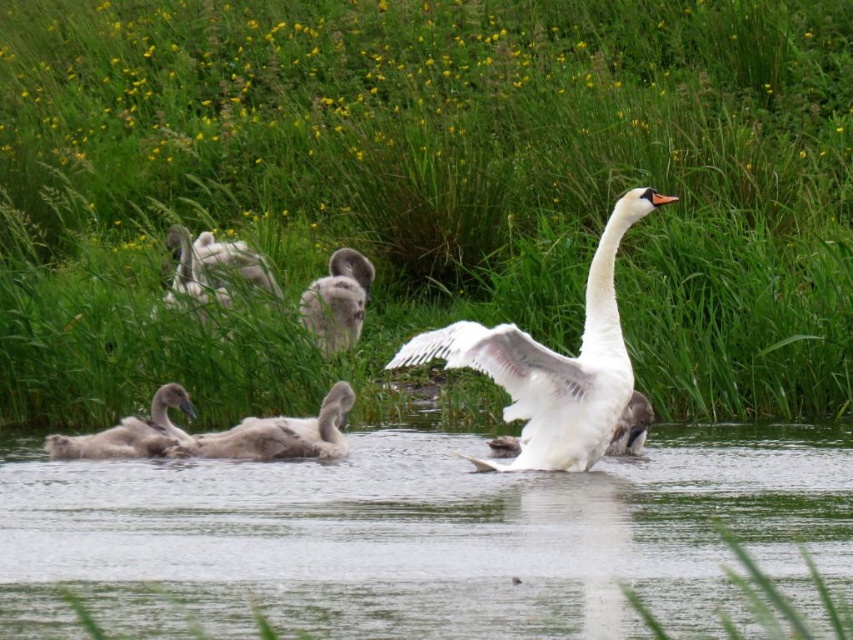
You are a wildlife photographer trying to capture a closeup of the gray downy gosling at center and the gray downy duckling at upper left. Given their sizes, which one might require you to get closer to fill the frame?

The gray downy gosling at center has a lesser width compared to the gray downy duckling at upper left, so you would need to get closer to the gray downy gosling at center to fill the frame.

You are a photographer trying to capture the white glossy swan at center in the clear water at center. Since the water is wider than the swan, how should you adjust your camera frame to ensure both are fully visible?

The clear water at center is wider than the white glossy swan at center, so you should position your camera frame to focus on the center area where both the swan and the water are present, ensuring the swan is centered and the water spans the width of the frame.